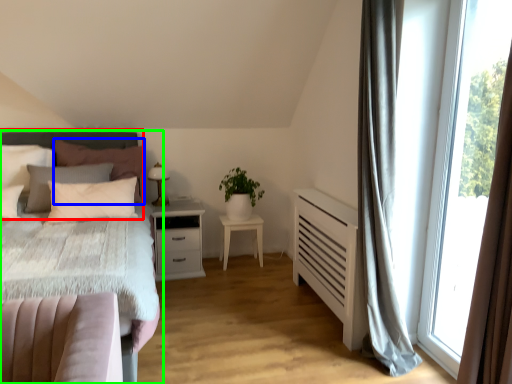
Question: Estimate the real-world distances between objects in this image. Which object is farther from headboard (highlighted by a red box), pillow (highlighted by a blue box) or bed (highlighted by a green box)?

Choices:
 (A) pillow
 (B) bed

Answer: (A)